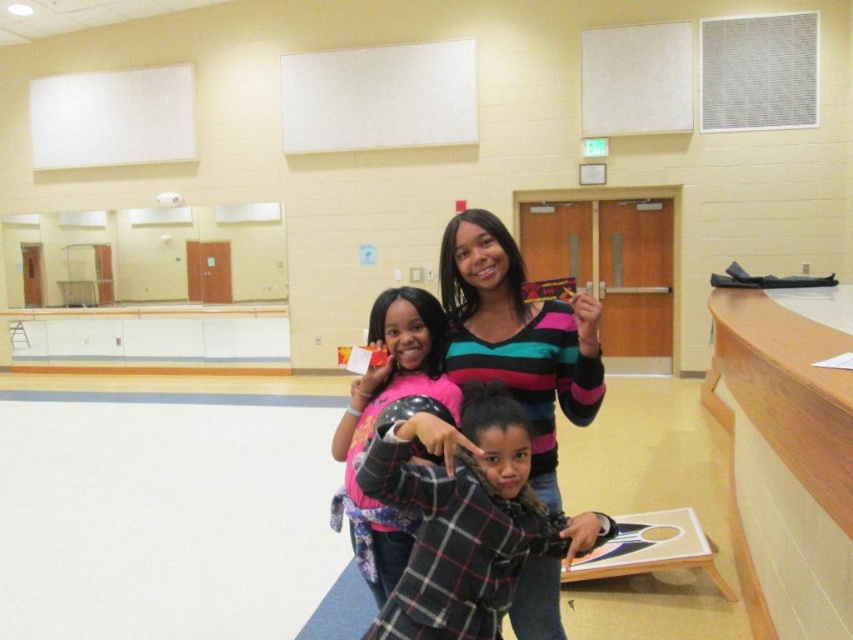
In the image of the dance studio, there is a point labeled at coordinates (x=518, y=337). Based on the scene description, what object or part of clothing is this point located on?

The point at (x=518, y=337) is located on the striped sweater at center.

You are a photographer setting up for a group photo in the dance studio. You want to ensure the plaid wool sweater at center is visible in the frame. Where should you position the camera relative to the point at (466, 516)?

The plaid wool sweater at center is located at point (466, 516), so positioning the camera directly facing this point will ensure it is visible in the frame.